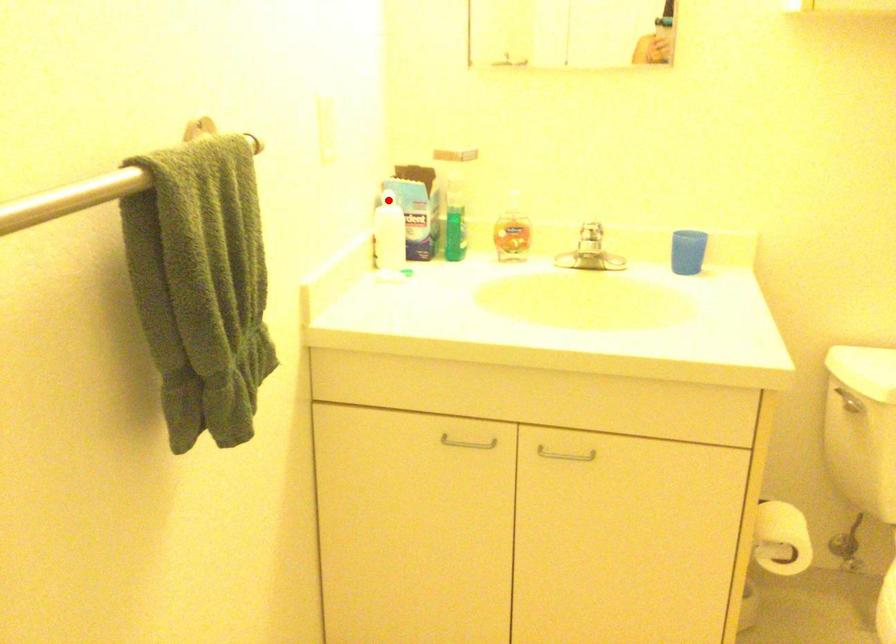
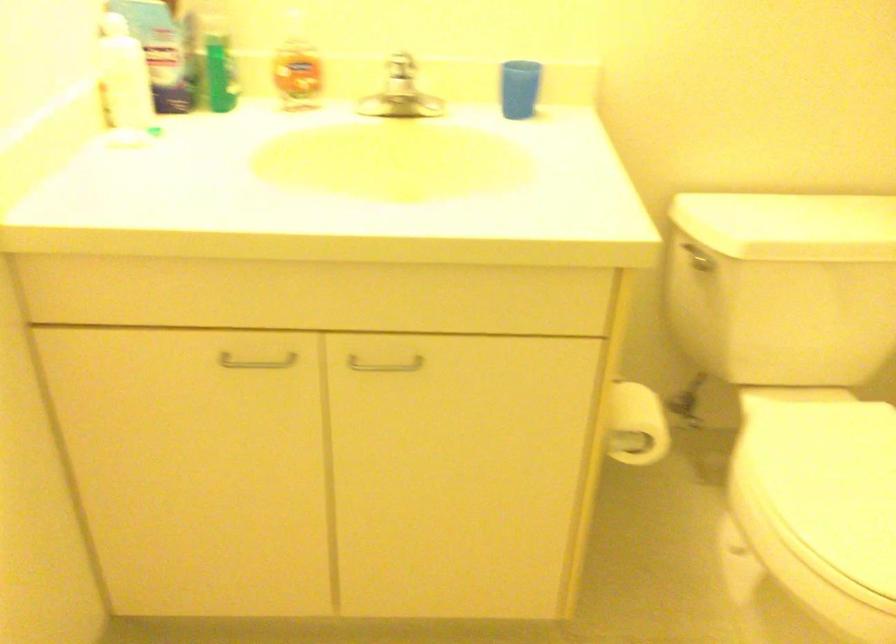
Question: I am providing you with two images of the same scene from different viewpoints. Image1 has a red point marked. In image2, the corresponding 3D location appears at what relative position? Reply with the corresponding letter.

Choices:
 (A) Closer
 (B) Farther

Answer: (A)